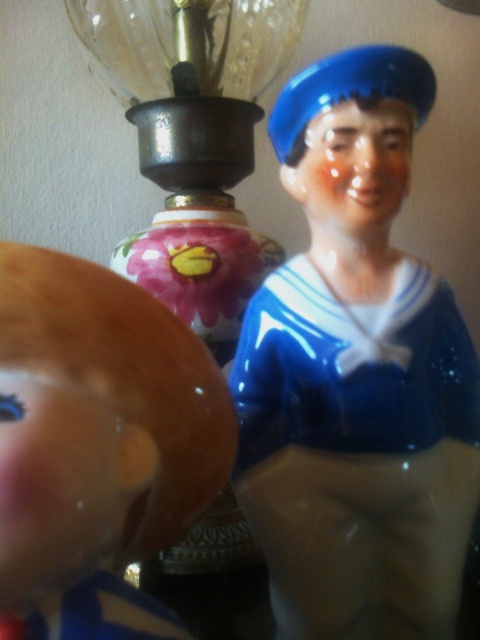
Who is higher up, blue glossy sailor figurine at upper right or transparent glass lamp at upper center?

transparent glass lamp at upper center is above.

The height and width of the screenshot is (640, 480). What do you see at coordinates (357, 374) in the screenshot? I see `blue glossy sailor figurine at upper right` at bounding box center [357, 374].

Between point (408, 275) and point (229, 22), which one is positioned in front?

Positioned in front is point (408, 275).

You are a GUI agent. You are given a task and a screenshot of the screen. Output one action in this format:
    pyautogui.click(x=<x>, y=<y>)
    Task: Click on the blue glossy sailor figurine at upper right
    
    Given the screenshot: What is the action you would take?
    pyautogui.click(x=357, y=374)

Is matte brown doll at left positioned in front of transparent glass lamp at upper center?

Yes, it is.

Does matte brown doll at left come behind transparent glass lamp at upper center?

No.

This screenshot has height=640, width=480. What do you see at coordinates (97, 440) in the screenshot? I see `matte brown doll at left` at bounding box center [97, 440].

What are the coordinates of `matte brown doll at left` in the screenshot? It's located at (97, 440).

Who is more forward, (x=364, y=196) or (x=19, y=570)?

Point (x=19, y=570) is more forward.

You are a GUI agent. You are given a task and a screenshot of the screen. Output one action in this format:
    pyautogui.click(x=<x>, y=<y>)
    Task: Click on the blue glossy sailor figurine at upper right
    
    Given the screenshot: What is the action you would take?
    pyautogui.click(x=357, y=374)